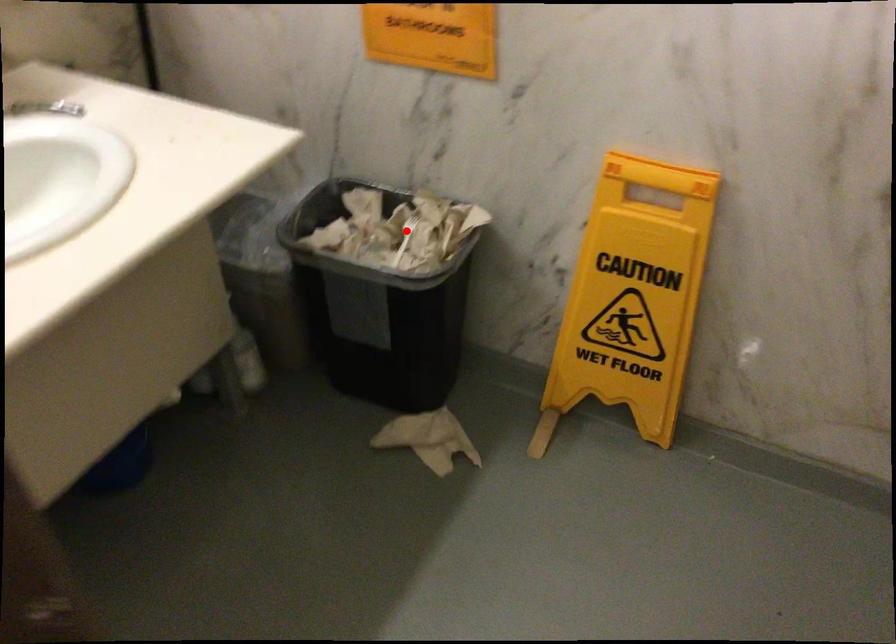
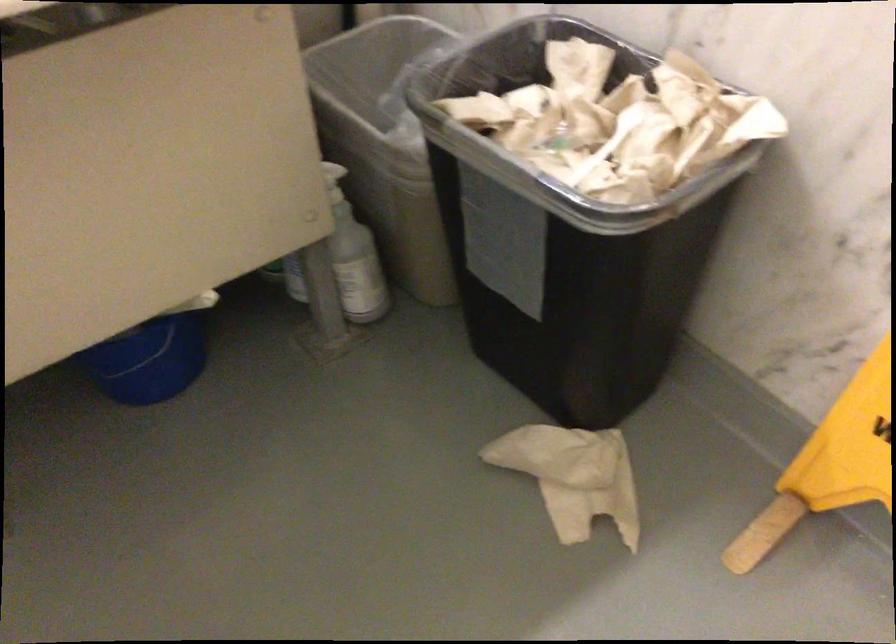
Question: I am providing you with two images of the same scene from different viewpoints. Image1 has a red point marked. In image2, the corresponding 3D location appears at what relative position? Reply with the corresponding letter.

Choices:
 (A) Closer
 (B) Farther

Answer: (A)